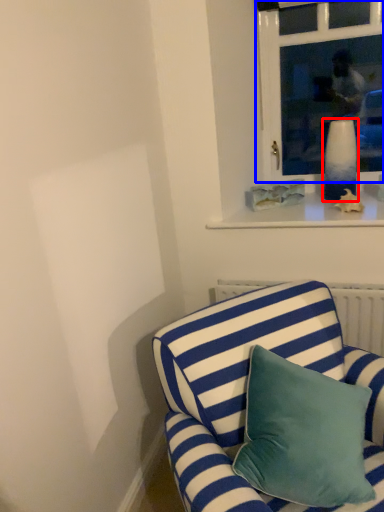
Question: Which of the following is the farthest to the observer, vase (highlighted by a red box) or window (highlighted by a blue box)?

Choices:
 (A) vase
 (B) window

Answer: (A)